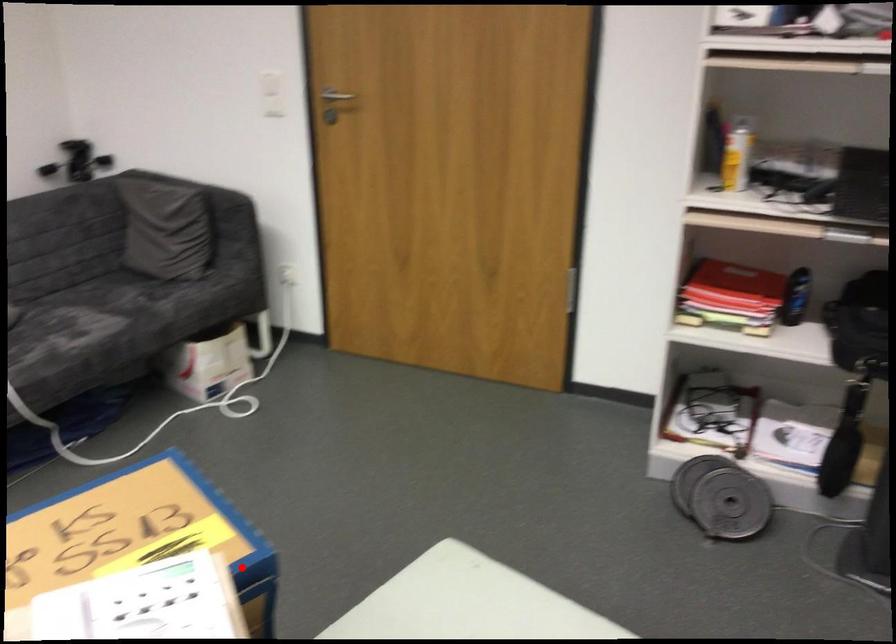
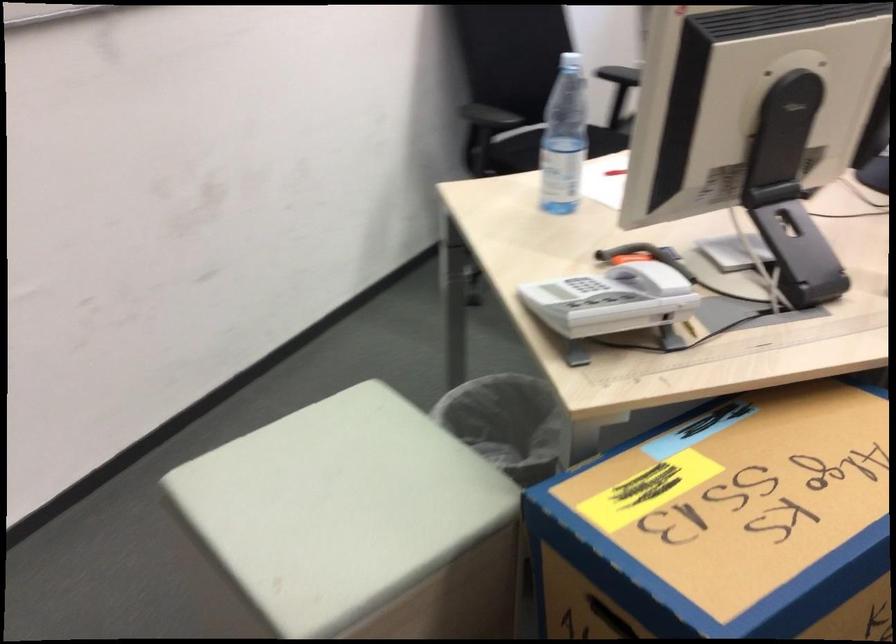
Question: I am providing you with two images of the same scene from different viewpoints. Image1 has a red point marked. In image2, the corresponding 3D location appears at what relative position? Reply with the corresponding letter.

Choices:
 (A) Closer
 (B) Farther

Answer: (A)